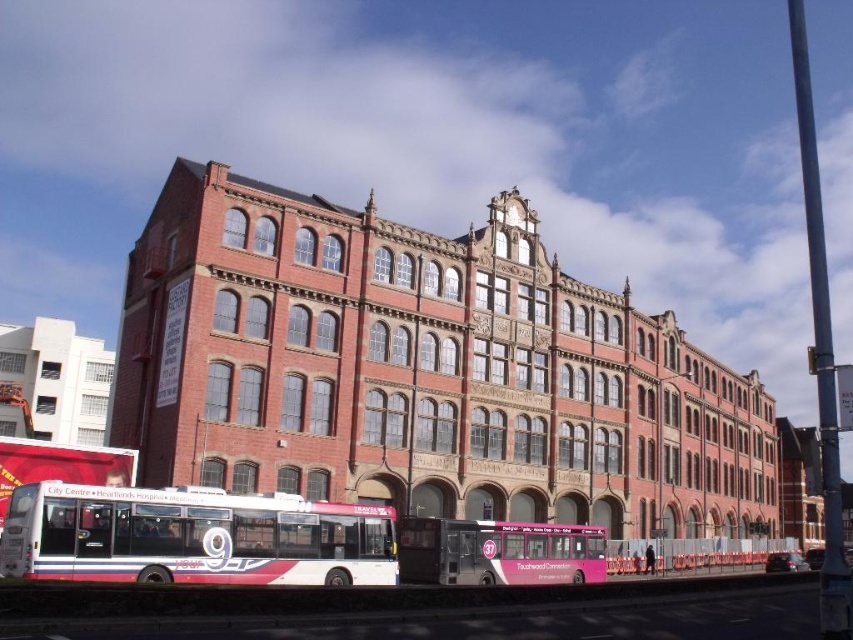
You are standing at the entrance of the large red brick building and want to walk to the point marked by point (260, 513) and point (590, 528). Which point should you head towards first if you want to reach both in the order they appear from your current position?

You should head towards point (260, 513) first because it is in front of point (590, 528) from your current position at the building entrance.

You are a pedestrian standing on the sidewalk in front of the large red brick building. You see the white glossy bus at lower left and the pink matte bus at center. Which bus is nearer to you?

The white glossy bus at lower left is closer to the viewer than the pink matte bus at center.

From the picture: You are a delivery person needing to unload a package from the back of your truck. The truck has a loading ramp that can only reach up to 1.2 meters in height. You have to choose between the white glossy bus at lower left and the pink matte bus at center. Which bus should you use to ensure the package can be safely loaded onto the truck?

The white glossy bus at lower left is taller than the pink matte bus at center. Since the loading ramp can reach up to 1.2 meters, you should choose the pink matte bus at center to ensure the package can be safely loaded onto the truck.